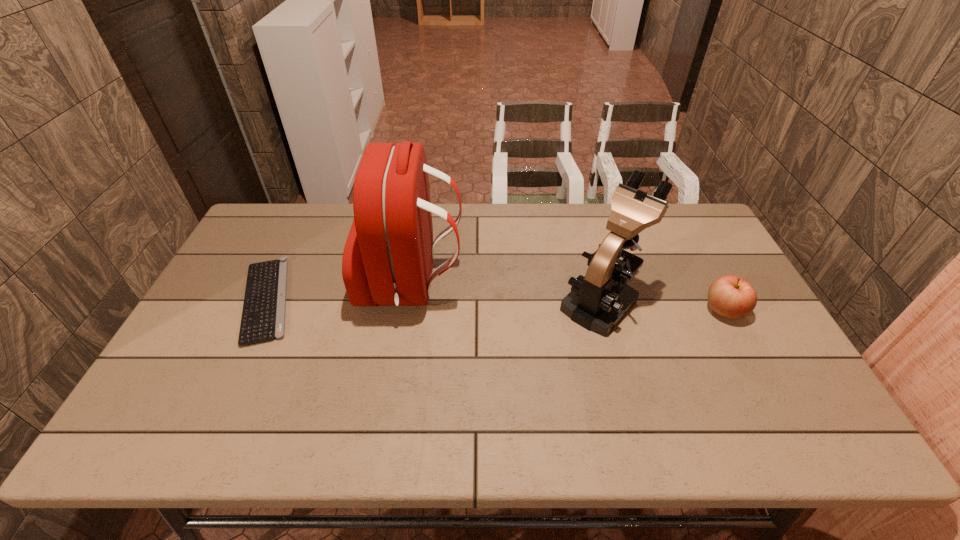
Identify the location of the tallest object. This screenshot has width=960, height=540. (392, 232).

The width and height of the screenshot is (960, 540). I want to click on backpack, so click(392, 232).

Find the location of a particular element. This screenshot has height=540, width=960. the second object from right to left is located at coordinates pos(597,302).

Locate an element on the screen. microscope is located at coordinates (597, 302).

The width and height of the screenshot is (960, 540). Identify the location of the rightmost object. (730, 296).

Locate an element on the screen. The height and width of the screenshot is (540, 960). apple is located at coordinates (730, 296).

Locate an element on the screen. The height and width of the screenshot is (540, 960). the leftmost object is located at coordinates (263, 316).

Locate an element on the screen. The width and height of the screenshot is (960, 540). computer keyboard is located at coordinates (263, 316).

Locate an element on the screen. This screenshot has width=960, height=540. vacant point located 0.180m on the strap side of the second object from left to right is located at coordinates (523, 285).

At what (x,y) coordinates should I click in order to perform the action: click on vacant space situated on the back of the microscope. Please return your answer as a coordinate pair (x, y). The image size is (960, 540). Looking at the image, I should click on (585, 239).